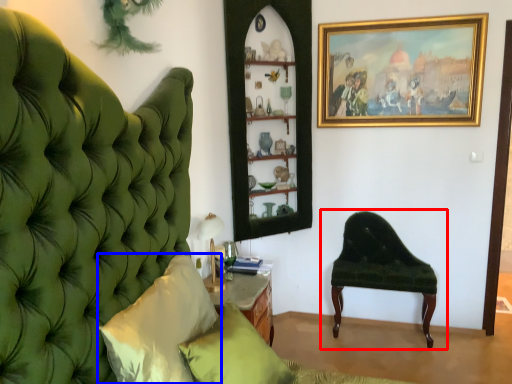
Question: Which object appears closest to the camera in this image, chair (highlighted by a red box) or pillow (highlighted by a blue box)?

Choices:
 (A) chair
 (B) pillow

Answer: (B)